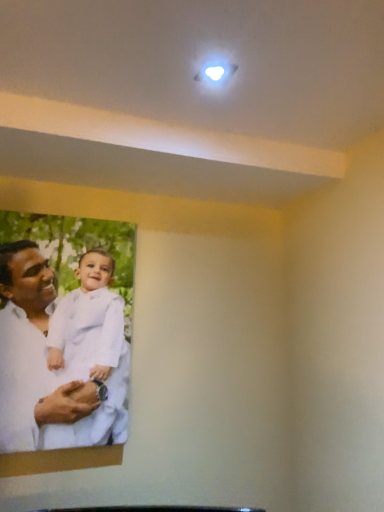
Question: Should I look upward or downward to see white matte/soft fabric man at lower left?

Choices:
 (A) down
 (B) up

Answer: (A)